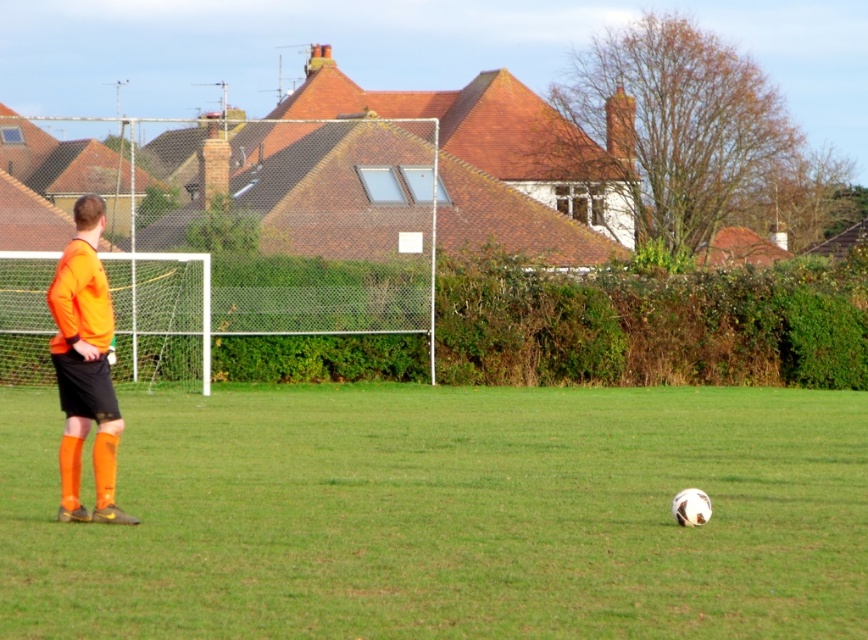
Is point (340, 465) farther from viewer compared to point (63, 324)?

Yes, point (340, 465) is farther from viewer.

Locate an element on the screen. green grass at center is located at coordinates (446, 515).

You are a GUI agent. You are given a task and a screenshot of the screen. Output one action in this format:
    pyautogui.click(x=<x>, y=<y>)
    Task: Click on the green grass at center
    
    Given the screenshot: What is the action you would take?
    pyautogui.click(x=446, y=515)